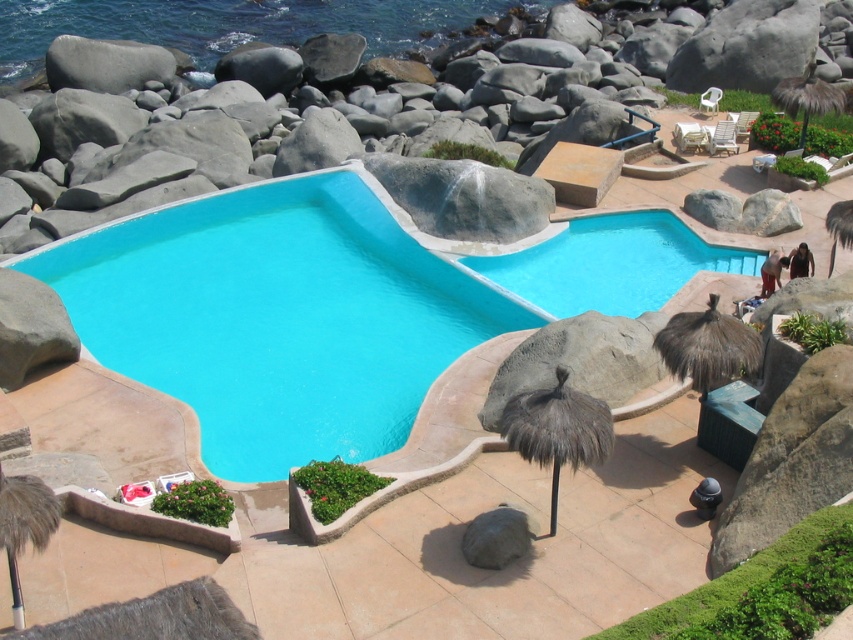
What do you see at coordinates (611, 262) in the screenshot? The image size is (853, 640). I see `blue concrete pool at center` at bounding box center [611, 262].

Which is behind, point (613, 268) or point (837, 227)?

Point (613, 268)

Describe the element at coordinates (611, 262) in the screenshot. The height and width of the screenshot is (640, 853). I see `blue concrete pool at center` at that location.

I want to click on blue concrete pool at center, so click(611, 262).

In the scene shown: Is blue concrete pool at center above brown feathered umbrella at lower left?

Yes, blue concrete pool at center is above brown feathered umbrella at lower left.

In the scene shown: Does blue concrete pool at center have a greater height compared to brown feathered umbrella at lower left?

Yes, blue concrete pool at center is taller than brown feathered umbrella at lower left.

Image resolution: width=853 pixels, height=640 pixels. What are the coordinates of `blue concrete pool at center` in the screenshot? It's located at (611, 262).

Is blue smooth pool at center thinner than blue concrete pool at center?

No, blue smooth pool at center is not thinner than blue concrete pool at center.

Is blue smooth pool at center wider than blue concrete pool at center?

Correct, the width of blue smooth pool at center exceeds that of blue concrete pool at center.

Locate an element on the screen. The height and width of the screenshot is (640, 853). blue smooth pool at center is located at coordinates (277, 317).